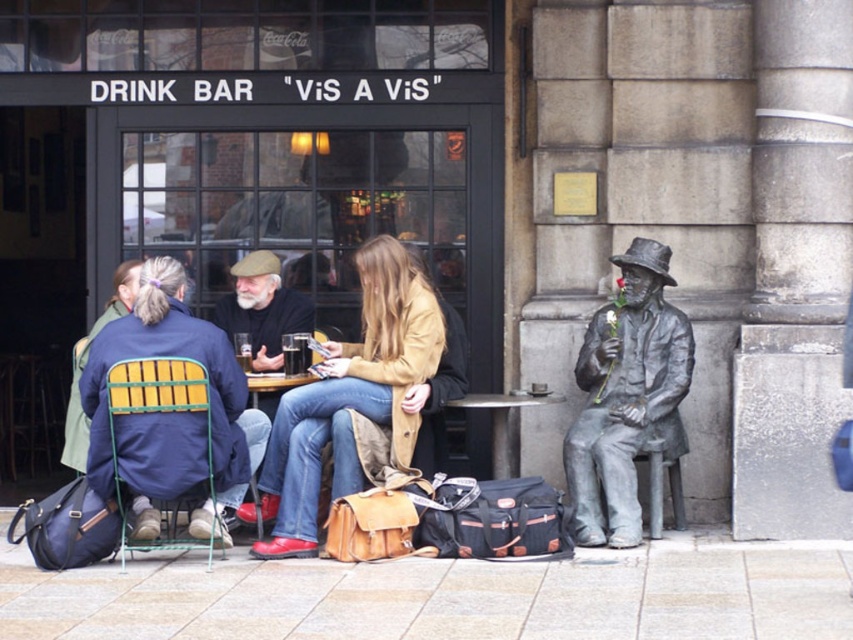
Question: Among these objects, which one is farthest from the camera?

Choices:
 (A) tan leather jacket at center
 (B) matte black jacket at center
 (C) brown leather jacket at center
 (D) matte black cup at center

Answer: (C)

Question: Which of the following is the closest to the observer?

Choices:
 (A) matte black jacket at center
 (B) brown leather jacket at center

Answer: (A)

Question: Estimate the real-world distances between objects in this image. Which object is closer to the bronze statue at right?

Choices:
 (A) matte black jacket at center
 (B) brown leather jacket at center
 (C) tan leather jacket at center
 (D) matte blue jacket at center

Answer: (C)

Question: Is the position of brown leather jacket at center less distant than that of matte black cup at center?

Choices:
 (A) yes
 (B) no

Answer: (B)

Question: Considering the relative positions of matte blue jacket at center and bronze statue at right in the image provided, where is matte blue jacket at center located with respect to bronze statue at right?

Choices:
 (A) below
 (B) above

Answer: (A)

Question: In this image, where is tan leather jacket at center located relative to matte black cup at center?

Choices:
 (A) below
 (B) above

Answer: (A)